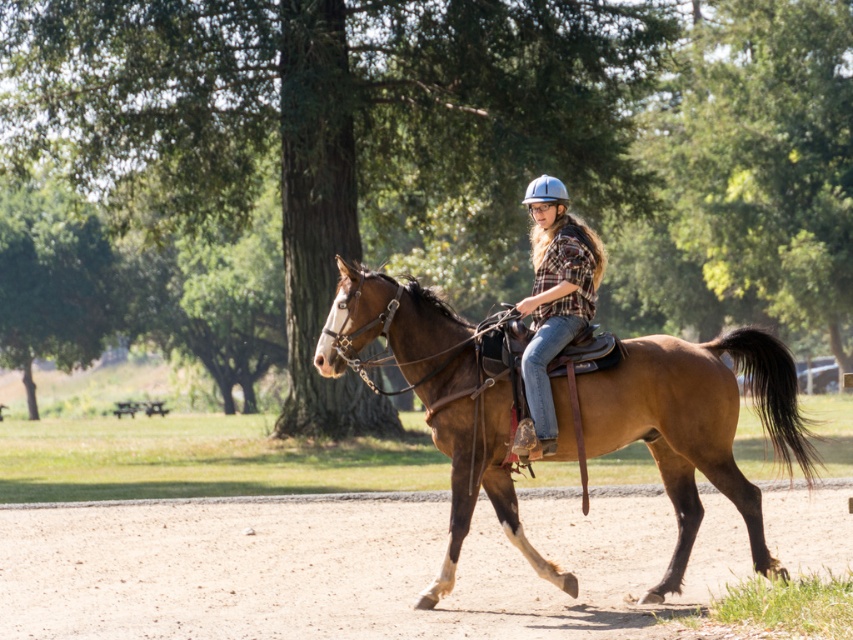
Does brown dirt track at lower center have a greater width compared to silver metallic helmet at center?

Correct, the width of brown dirt track at lower center exceeds that of silver metallic helmet at center.

The image size is (853, 640). What do you see at coordinates (352, 568) in the screenshot?
I see `brown dirt track at lower center` at bounding box center [352, 568].

You are a GUI agent. You are given a task and a screenshot of the screen. Output one action in this format:
    pyautogui.click(x=<x>, y=<y>)
    Task: Click on the brown dirt track at lower center
    
    Given the screenshot: What is the action you would take?
    pyautogui.click(x=352, y=568)

Locate an element on the screen. The width and height of the screenshot is (853, 640). brown dirt track at lower center is located at coordinates (352, 568).

This screenshot has width=853, height=640. I want to click on brown dirt track at lower center, so click(352, 568).

Can you confirm if brown dirt track at lower center is taller than brown leather saddle at center?

Incorrect, brown dirt track at lower center's height is not larger of brown leather saddle at center's.

This screenshot has height=640, width=853. I want to click on brown dirt track at lower center, so click(352, 568).

Is brown leather saddle at center thinner than plaid fabric shirt at center?

In fact, brown leather saddle at center might be wider than plaid fabric shirt at center.

Between brown leather saddle at center and plaid fabric shirt at center, which one has more height?

Standing taller between the two is plaid fabric shirt at center.

Is point (653, 433) less distant than point (552, 449)?

No, it is behind (552, 449).

Find the location of a particular element. The height and width of the screenshot is (640, 853). brown leather saddle at center is located at coordinates (695, 426).